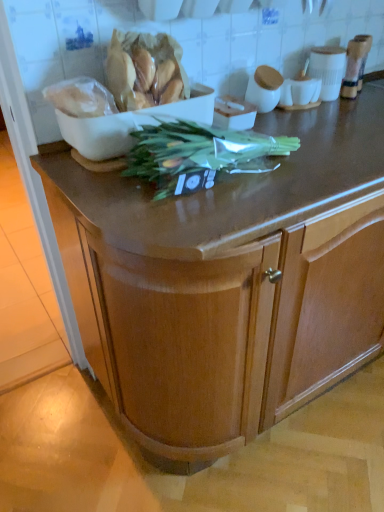
Question: Is green leafy vegetable at center completely or partially inside translucent plastic bag of bread at upper left, the 2th food from the left?

Choices:
 (A) no
 (B) yes

Answer: (A)

Question: Is translucent plastic bag of bread at upper left, the 2th food from the left, turned away from green leafy vegetable at center?

Choices:
 (A) no
 (B) yes

Answer: (A)

Question: Is translucent plastic bag of bread at upper left, the 1th food when ordered from right to left, thinner than green leafy vegetable at center?

Choices:
 (A) yes
 (B) no

Answer: (A)

Question: Is translucent plastic bag of bread at upper left, the 1th food when ordered from right to left, positioned behind green leafy vegetable at center?

Choices:
 (A) no
 (B) yes

Answer: (B)

Question: From a real-world perspective, is translucent plastic bag of bread at upper left, the 1th food when ordered from right to left, below green leafy vegetable at center?

Choices:
 (A) yes
 (B) no

Answer: (B)

Question: From the image's perspective, is translucent plastic bag of bread at upper left, the 1th food when ordered from right to left, located beneath green leafy vegetable at center?

Choices:
 (A) yes
 (B) no

Answer: (B)

Question: Considering the relative sizes of translucent plastic bag of bread at upper left, the 2th food from the left, and white glossy cup at upper right in the image provided, is translucent plastic bag of bread at upper left, the 2th food from the left, thinner than white glossy cup at upper right?

Choices:
 (A) no
 (B) yes

Answer: (A)

Question: From a real-world perspective, does translucent plastic bag of bread at upper left, the 2th food from the left, stand above white glossy cup at upper right?

Choices:
 (A) yes
 (B) no

Answer: (A)

Question: Considering the relative positions of translucent plastic bag of bread at upper left, the 1th food when ordered from right to left, and white glossy cup at upper right in the image provided, is translucent plastic bag of bread at upper left, the 1th food when ordered from right to left, to the right of white glossy cup at upper right from the viewer's perspective?

Choices:
 (A) no
 (B) yes

Answer: (A)

Question: Can you confirm if translucent plastic bag of bread at upper left, the 2th food from the left, is bigger than white glossy cup at upper right?

Choices:
 (A) no
 (B) yes

Answer: (B)

Question: From a real-world perspective, is translucent plastic bag of bread at upper left, the 1th food when ordered from right to left, positioned under white glossy cup at upper right based on gravity?

Choices:
 (A) no
 (B) yes

Answer: (A)

Question: Is translucent plastic bag of bread at upper left, the 2th food from the left, touching white glossy cup at upper right?

Choices:
 (A) no
 (B) yes

Answer: (A)

Question: Is wooden cabinet at center bigger than white matte bowl at upper left?

Choices:
 (A) yes
 (B) no

Answer: (A)